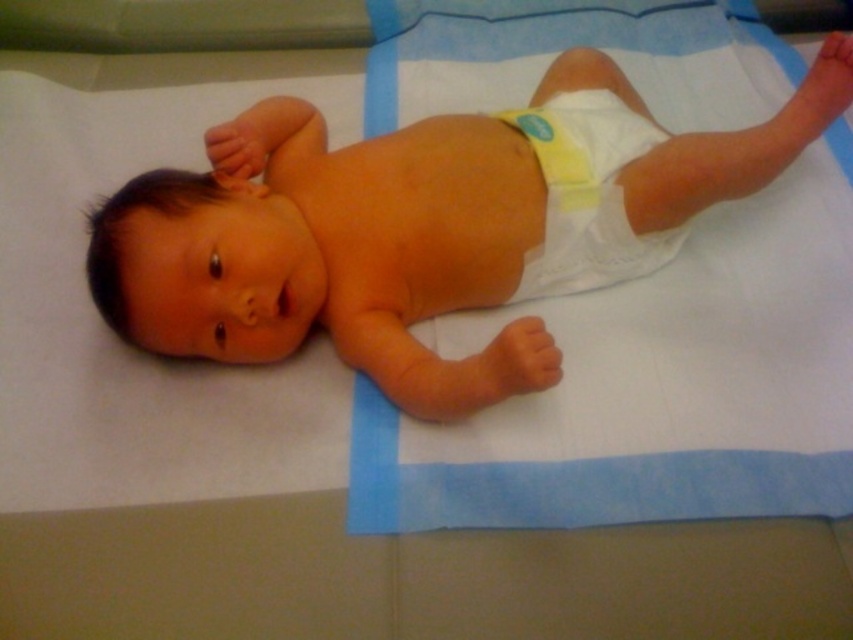
Can you confirm if smooth skin baby at center is positioned below white cloth diaper at center?

Actually, smooth skin baby at center is above white cloth diaper at center.

You are a GUI agent. You are given a task and a screenshot of the screen. Output one action in this format:
    pyautogui.click(x=<x>, y=<y>)
    Task: Click on the smooth skin baby at center
    
    Given the screenshot: What is the action you would take?
    pyautogui.click(x=427, y=227)